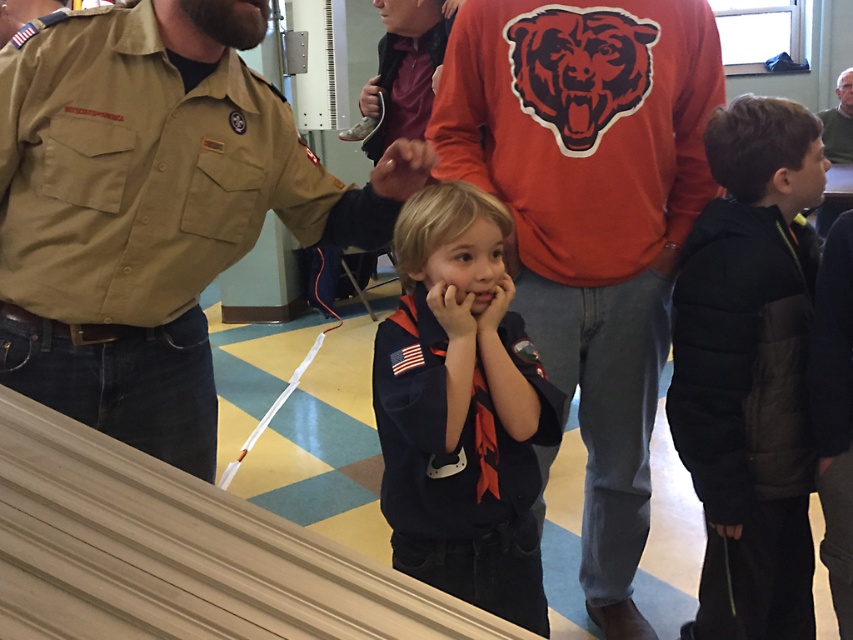
From the picture: Based on the scene description, which object is taller between the black puffy jacket at right and the navy blue uniform at center?

The black puffy jacket at right is taller than the navy blue uniform at center according to the description.